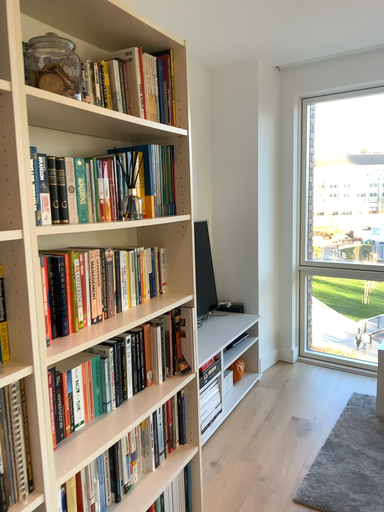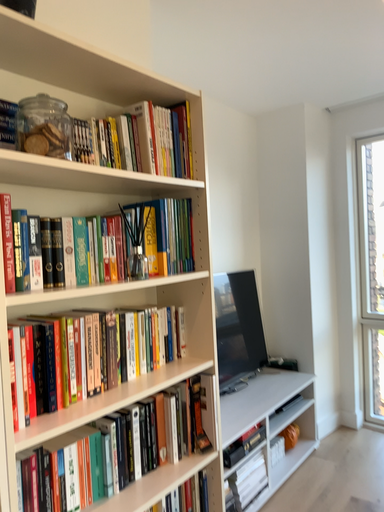
Question: Which way did the camera rotate in the video?

Choices:
 (A) rotated right
 (B) rotated left

Answer: (B)